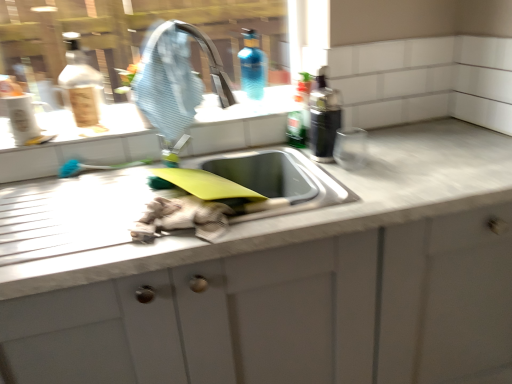
Where is `vacant region above white glossy sink at upper center (from a real-world perspective)`? The image size is (512, 384). vacant region above white glossy sink at upper center (from a real-world perspective) is located at coordinates (194, 117).